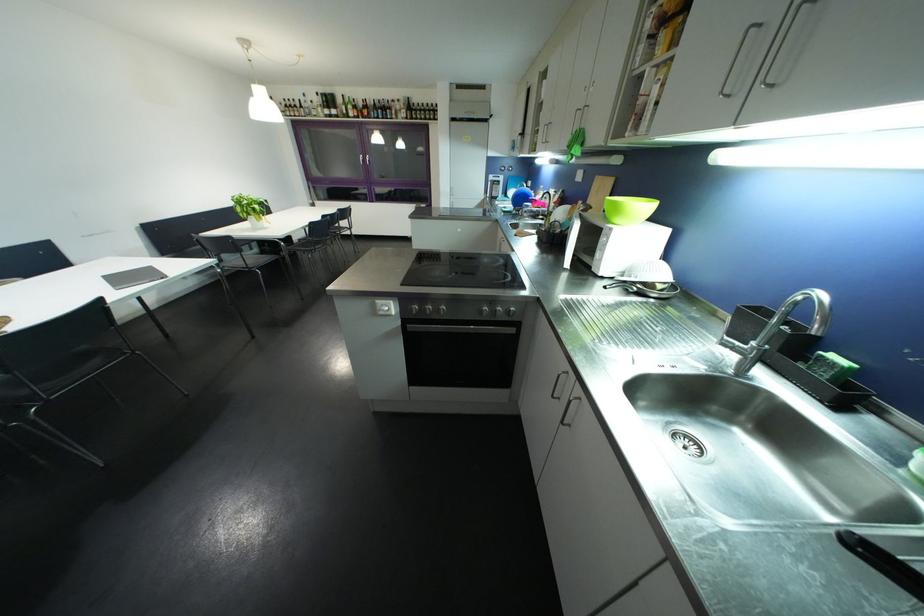
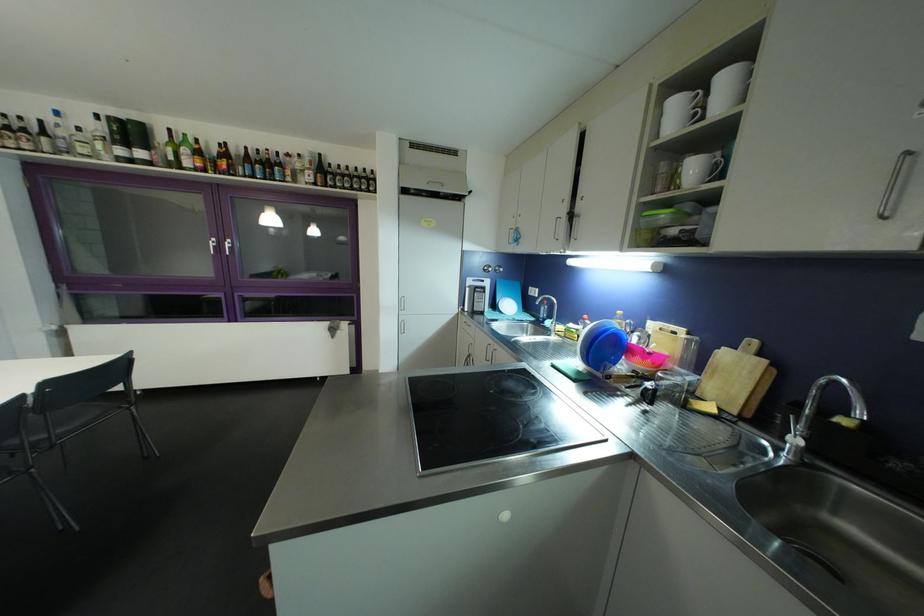
Find the pixel in the second image that matches the point at 371,161 in the first image.

(227, 246)